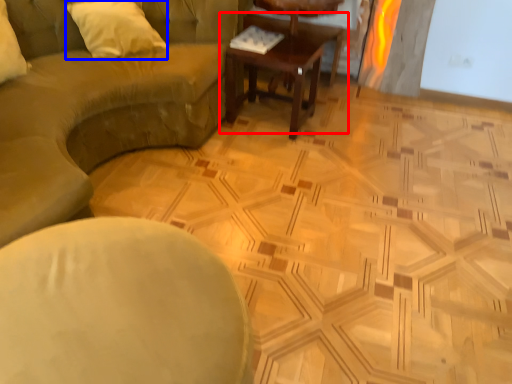
Question: Which point is further to the camera, coffee table (highlighted by a red box) or pillow (highlighted by a blue box)?

Choices:
 (A) coffee table
 (B) pillow

Answer: (A)